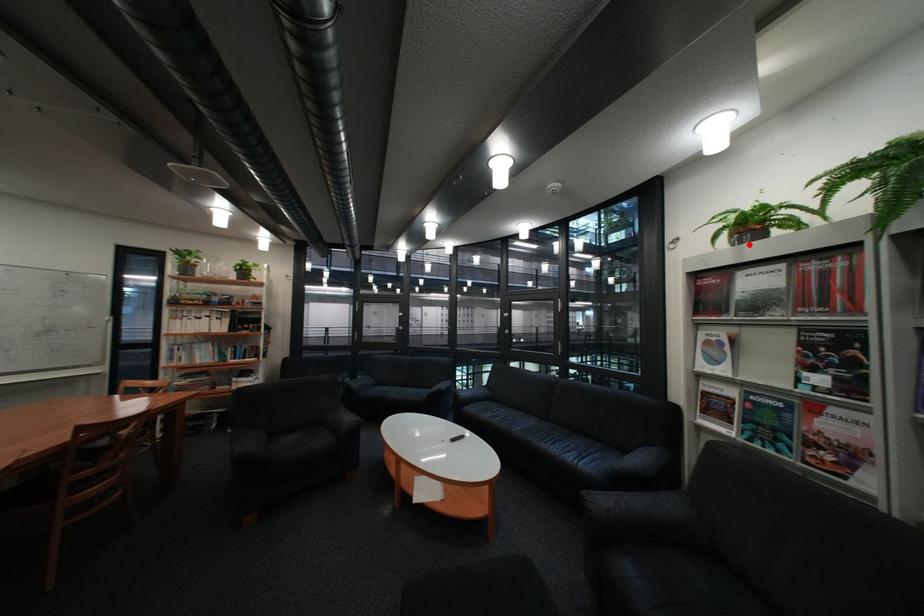
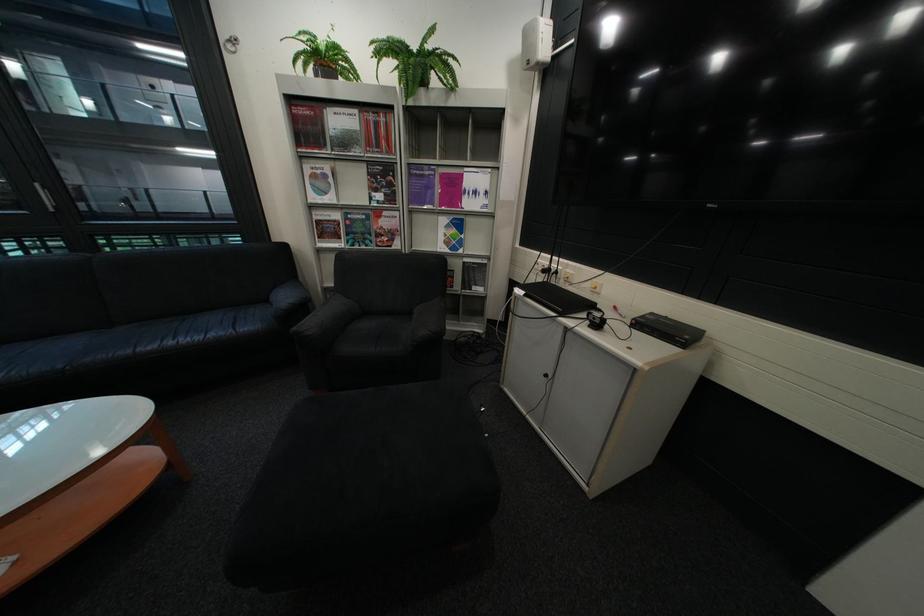
The point at the highlighted location is marked in the first image. Where is the corresponding point in the second image?

(333, 78)